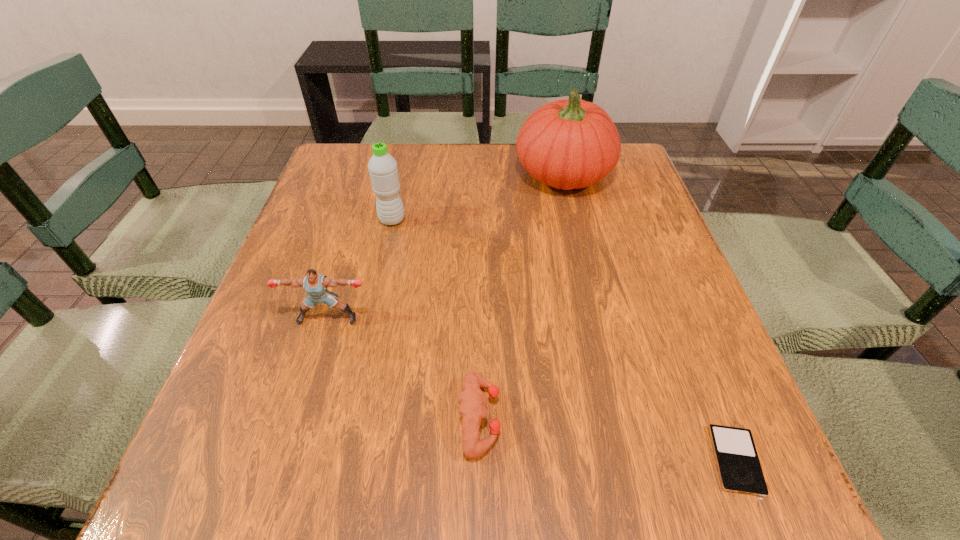
What are the coordinates of `object located at the near right corner` in the screenshot? It's located at (739, 468).

In the image, there is a desktop. What are the coordinates of `vacant region at the far edge` in the screenshot? It's located at (465, 184).

Find the location of `free space at the near edge of the desktop`. free space at the near edge of the desktop is located at coordinates (464, 461).

In the image, there is a desktop. At what (x,y) coordinates should I click in order to perform the action: click on blank space at the left edge. Please return your answer as a coordinate pair (x, y). This screenshot has width=960, height=540. Looking at the image, I should click on (278, 303).

I want to click on vacant space at the right edge of the desktop, so click(x=712, y=337).

At what (x,y) coordinates should I click in order to perform the action: click on vacant space at the near right corner of the desktop. Please return your answer as a coordinate pair (x, y). Looking at the image, I should click on (777, 497).

The width and height of the screenshot is (960, 540). Identify the location of unoccupied area between the pumpkin and the water bottle. (478, 197).

Where is `vacant point located between the right puncher and the fourth nearest object`? The height and width of the screenshot is (540, 960). vacant point located between the right puncher and the fourth nearest object is located at coordinates (436, 319).

Image resolution: width=960 pixels, height=540 pixels. Find the location of `free space between the fourth shortest object and the third nearest object`. free space between the fourth shortest object and the third nearest object is located at coordinates (360, 269).

The height and width of the screenshot is (540, 960). Identify the location of free spot between the shortest object and the pumpkin. (650, 317).